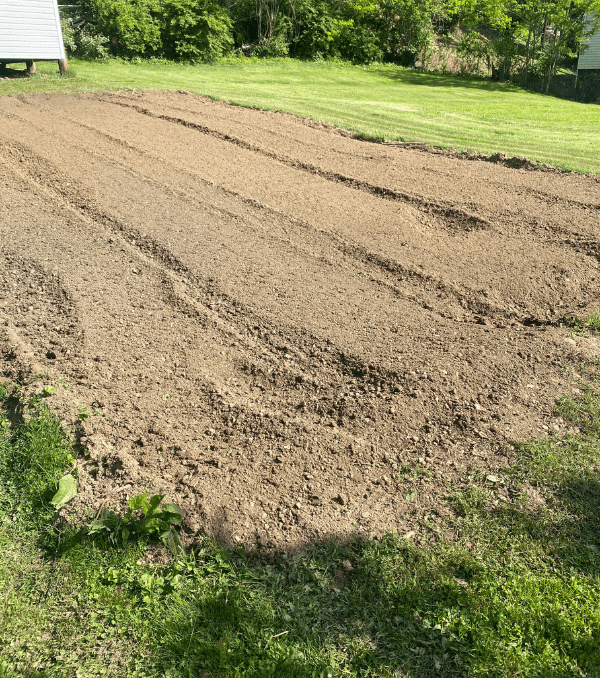
Image resolution: width=600 pixels, height=678 pixels. Identify the location of plant. (153, 510).